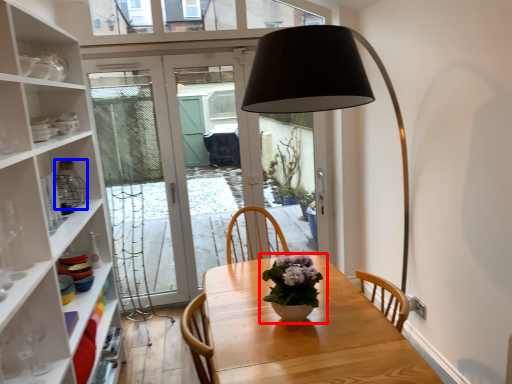
Question: Among these objects, which one is farthest to the camera, houseplant (highlighted by a red box) or glass vase (highlighted by a blue box)?

Choices:
 (A) houseplant
 (B) glass vase

Answer: (B)